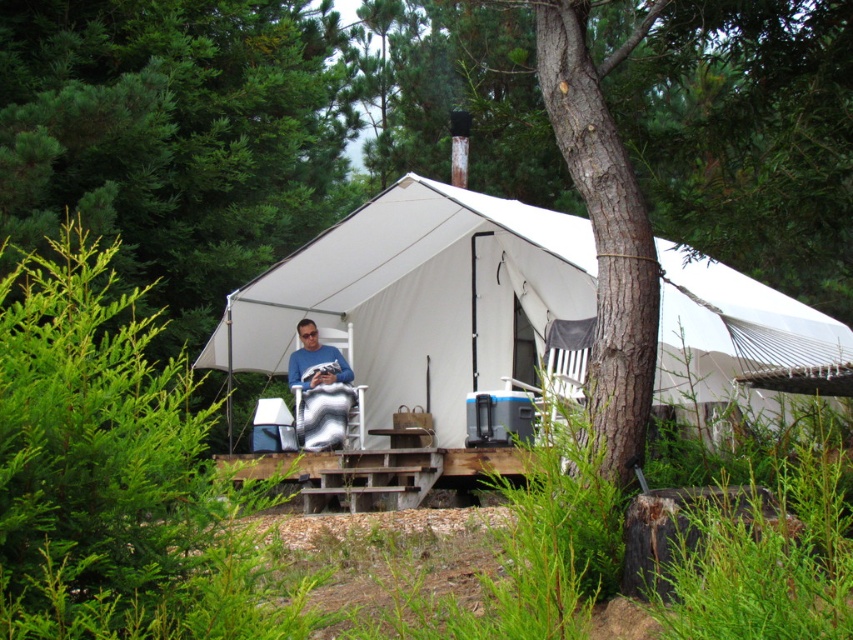
You are a hiker who wants to take a photo of the white canvas tent at center and the matte blue shirt at center from a position where both are visible. Based on their positions, where should you stand relative to the objects to ensure both are in the frame?

Since the white canvas tent at center is located above the matte blue shirt at center, you should position yourself below the tent and facing upwards to include both the tent above and the shirt below in your photo.

You are a hiker who wants to know if you can stand up inside the white canvas tent at center while wearing the matte blue shirt at center. Based on the scene description, can you do that?

The white canvas tent at center has a greater height compared to matte blue shirt at center, so yes, you can stand up inside the white canvas tent at center while wearing the matte blue shirt at center because the tent is taller than the shirt.

You are a hiker who has just arrived at the campsite and wants to put your backpack on the ground near the white canvas tent at center and the matte blue shirt at center. Based on their positions, which object should you place the backpack closer to if you want it to be on the right side of the shirt?

You should place the backpack closer to the white canvas tent at center because it is already positioned to the right of the matte blue shirt at center.